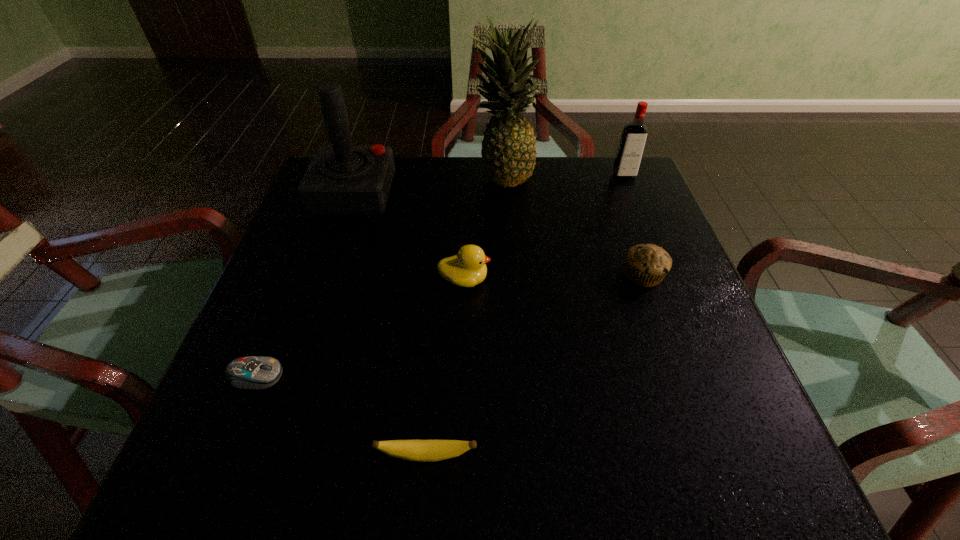
Select which object is the closest to the tallest object. Please provide its 2D coordinates. Your answer should be formatted as a tuple, i.e. [(x, y)], where the tuple contains the x and y coordinates of a point satisfying the conditions above.

[(342, 179)]

Identify which object is the third closest to the vodka. Please provide its 2D coordinates. Your answer should be formatted as a tuple, i.e. [(x, y)], where the tuple contains the x and y coordinates of a point satisfying the conditions above.

[(466, 269)]

Where is `vacant region that satisfies the following two spatial constraints: 1. on the front side of the third shortest object; 2. on the right side of the pineapple`? Image resolution: width=960 pixels, height=540 pixels. vacant region that satisfies the following two spatial constraints: 1. on the front side of the third shortest object; 2. on the right side of the pineapple is located at coordinates (508, 275).

Locate an element on the screen. Image resolution: width=960 pixels, height=540 pixels. vacant position in the image that satisfies the following two spatial constraints: 1. on the front side of the fifth tallest object; 2. on the beak of the fourth shortest object is located at coordinates (644, 280).

Image resolution: width=960 pixels, height=540 pixels. What are the coordinates of `free space in the image that satisfies the following two spatial constraints: 1. on the front side of the pineapple; 2. on the beak of the duckling` in the screenshot? It's located at (508, 280).

You are a GUI agent. You are given a task and a screenshot of the screen. Output one action in this format:
    pyautogui.click(x=<x>, y=<y>)
    Task: Click on the blank space that satisfies the following two spatial constraints: 1. on the wheel side of the computer mouse; 2. on the right side of the banana
    This screenshot has height=540, width=960.
    Given the screenshot: What is the action you would take?
    pyautogui.click(x=224, y=455)

Where is `free space in the image that satisfies the following two spatial constraints: 1. on the base of the joystick; 2. on the left side of the banana`? The height and width of the screenshot is (540, 960). free space in the image that satisfies the following two spatial constraints: 1. on the base of the joystick; 2. on the left side of the banana is located at coordinates (266, 455).

At what (x,y) coordinates should I click in order to perform the action: click on vacant space that satisfies the following two spatial constraints: 1. on the front and back of the vodka; 2. on the base of the joystick. Please return your answer as a coordinate pair (x, y). Looking at the image, I should click on (631, 194).

Where is `free space that satisfies the following two spatial constraints: 1. on the base of the nearest object; 2. on the right side of the joystick`? This screenshot has height=540, width=960. free space that satisfies the following two spatial constraints: 1. on the base of the nearest object; 2. on the right side of the joystick is located at coordinates (266, 455).

Where is `vacant space that satisfies the following two spatial constraints: 1. on the front and back of the fifth shortest object; 2. on the beak of the fourth shortest object`? The height and width of the screenshot is (540, 960). vacant space that satisfies the following two spatial constraints: 1. on the front and back of the fifth shortest object; 2. on the beak of the fourth shortest object is located at coordinates (665, 280).